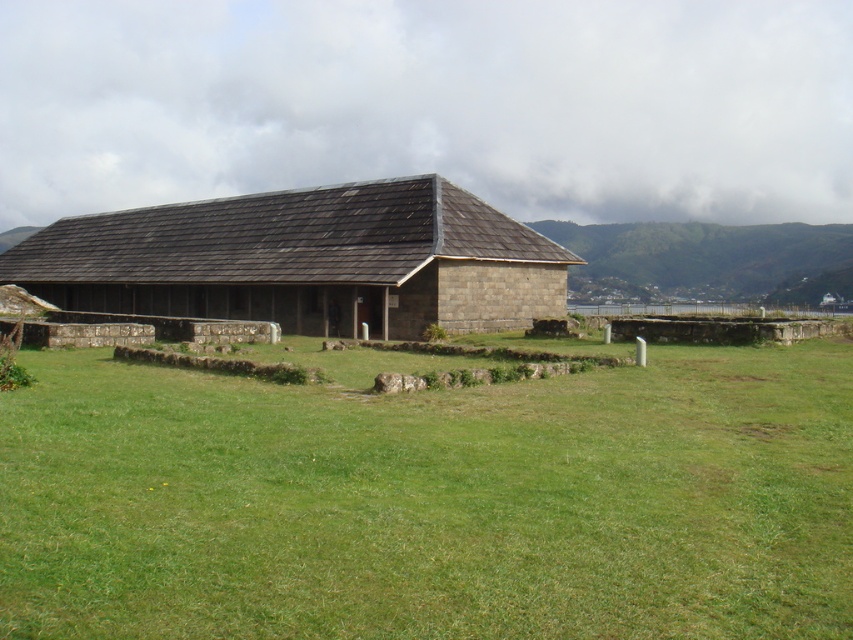
Question: Can you confirm if stone shingled hut at center is positioned below green grassy hillside at upper right?

Choices:
 (A) no
 (B) yes

Answer: (B)

Question: Is stone shingled hut at center below green grassy hillside at upper right?

Choices:
 (A) yes
 (B) no

Answer: (A)

Question: Which of these objects is positioned farthest from the green grassy hillside at upper right?

Choices:
 (A) stone shingled hut at center
 (B) green grass at center

Answer: (B)

Question: Can you confirm if stone shingled hut at center is smaller than green grassy hillside at upper right?

Choices:
 (A) no
 (B) yes

Answer: (B)

Question: Which object is closer to the camera taking this photo?

Choices:
 (A) green grass at center
 (B) green grassy hillside at upper right

Answer: (A)

Question: Which point appears closest to the camera in this image?

Choices:
 (A) (664, 273)
 (B) (398, 406)

Answer: (B)